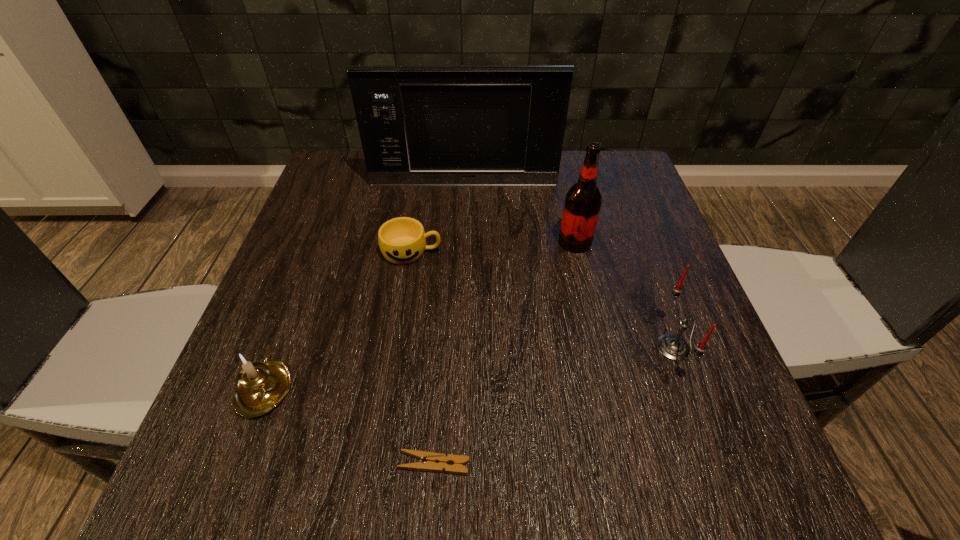
At what (x,y) coordinates should I click in order to perform the action: click on vacant area situated on the front panel of the tallest object. Please return your answer as a coordinate pair (x, y). The width and height of the screenshot is (960, 540). Looking at the image, I should click on (459, 301).

Find the location of a particular element. blank space located 0.250m on the left of the fifth shortest object is located at coordinates (441, 242).

Identify the location of vacant position located 0.170m on the front-facing side of the third tallest object. (556, 348).

This screenshot has height=540, width=960. What are the coordinates of `vacant space located 0.270m on the front-facing side of the third tallest object` in the screenshot? It's located at (497, 348).

Image resolution: width=960 pixels, height=540 pixels. Find the location of `vacant space situated 0.180m on the front-facing side of the third tallest object`. vacant space situated 0.180m on the front-facing side of the third tallest object is located at coordinates (550, 348).

Where is `vacant space located 0.070m on the handle side of the leftmost object`? This screenshot has height=540, width=960. vacant space located 0.070m on the handle side of the leftmost object is located at coordinates (290, 322).

You are a GUI agent. You are given a task and a screenshot of the screen. Output one action in this format:
    pyautogui.click(x=<x>, y=<y>)
    Task: Click on the vacant space situated 0.190m on the handle side of the leftmost object
    The height and width of the screenshot is (540, 960).
    Given the screenshot: What is the action you would take?
    pyautogui.click(x=308, y=274)

Locate an element on the screen. free spot located on the handle side of the leftmost object is located at coordinates (300, 293).

Locate an element on the screen. This screenshot has width=960, height=540. vacant space located on the front of the cup is located at coordinates (405, 291).

Identify the location of vacant region located 0.050m on the back of the shortest object. The image size is (960, 540). (438, 419).